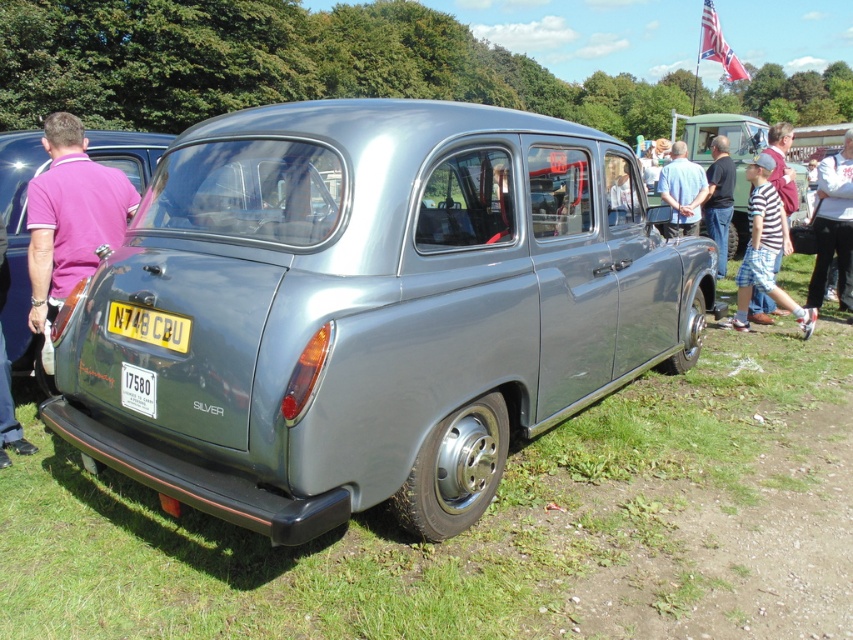
Question: Which point is farther to the camera?

Choices:
 (A) satin silver car at center
 (B) green grass at lower center
 (C) yellow plastic license plate at center

Answer: (C)

Question: Can you confirm if blue shirt at center is wider than yellow plastic license plate at center?

Choices:
 (A) yes
 (B) no

Answer: (A)

Question: Which point appears closest to the camera in this image?

Choices:
 (A) (219, 134)
 (B) (706, 204)
 (C) (827, 262)
 (D) (59, 273)

Answer: (A)

Question: Which point appears closest to the camera in this image?

Choices:
 (A) (111, 193)
 (B) (676, 157)
 (C) (830, 172)

Answer: (A)

Question: Is satin silver car at center wider than green grass at lower center?

Choices:
 (A) yes
 (B) no

Answer: (A)

Question: Is green grass at lower center positioned before black fabric shirt at center?

Choices:
 (A) yes
 (B) no

Answer: (A)